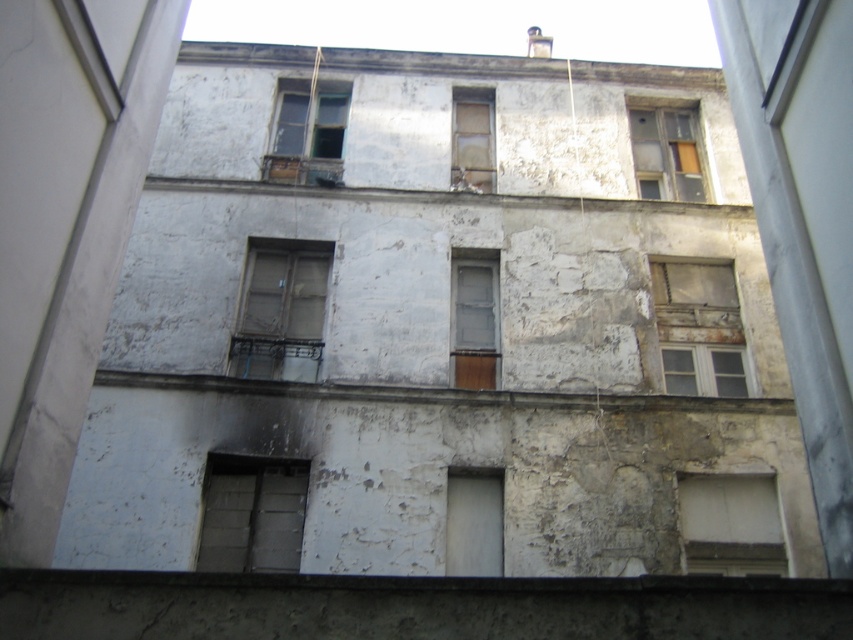
Question: Which of the following is the closest to the observer?

Choices:
 (A) (740, 564)
 (B) (219, 566)
 (C) (463, 500)
 (D) (695, 282)

Answer: (B)

Question: Is wooden window frame at center further to the viewer compared to transparent glass window at upper center?

Choices:
 (A) yes
 (B) no

Answer: (B)

Question: Can you confirm if wooden window frame at center is smaller than matte gray window at center?

Choices:
 (A) no
 (B) yes

Answer: (B)

Question: Which of the following is the closest to the observer?

Choices:
 (A) transparent glass window at upper right
 (B) wooden window frame at center
 (C) transparent glass window at upper center

Answer: (B)

Question: Which object is the closest to the gray concrete window at center?

Choices:
 (A) transparent glass window at upper right
 (B) transparent glass window at upper center

Answer: (B)

Question: Considering the relative positions of transparent glass window at upper center and matte gray window at center in the image provided, where is transparent glass window at upper center located with respect to matte gray window at center?

Choices:
 (A) left
 (B) right

Answer: (A)